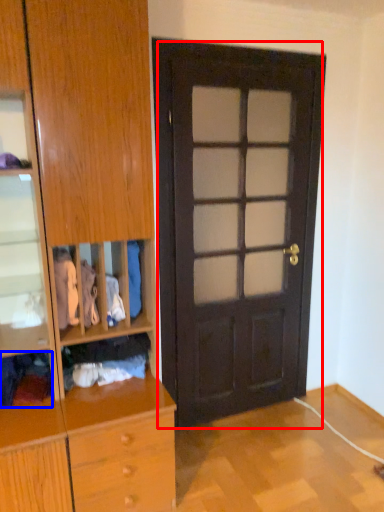
Question: Which object is closer to the camera taking this photo, door (highlighted by a red box) or clothing (highlighted by a blue box)?

Choices:
 (A) door
 (B) clothing

Answer: (B)